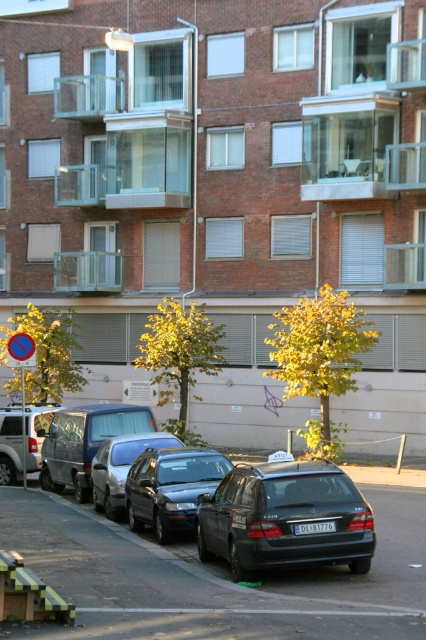
You are standing at the center of the street and want to find the matte silver van at left. According to the coordinates provided, in which direction should you look to locate it?

The matte silver van at left is located at coordinates point (85, 442), meaning it is positioned to the left side of the scene. Therefore, you should look to your left to locate it.

Consider the image. You are a delivery person trying to park your van between the matte black station wagon at center and the shiny silver sedan at center. Based on their widths, do you think there is enough space for your van?

The matte black station wagon at center might be wider than the shiny silver sedan at center, so the available space between them may not be sufficient for your van. It is recommended to look for another parking spot.